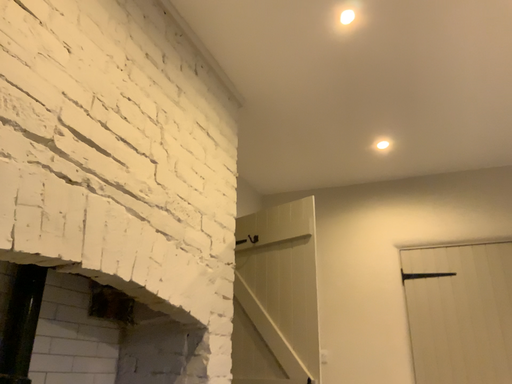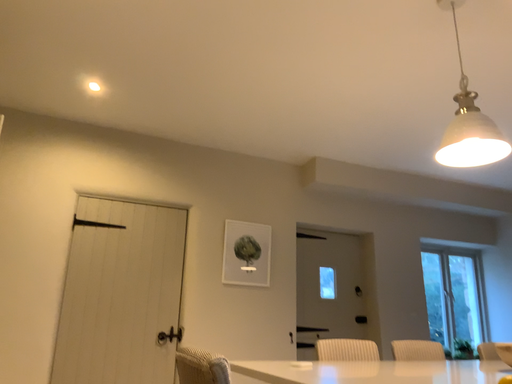
Question: Which way did the camera rotate in the video?

Choices:
 (A) rotated downward
 (B) rotated upward

Answer: (A)